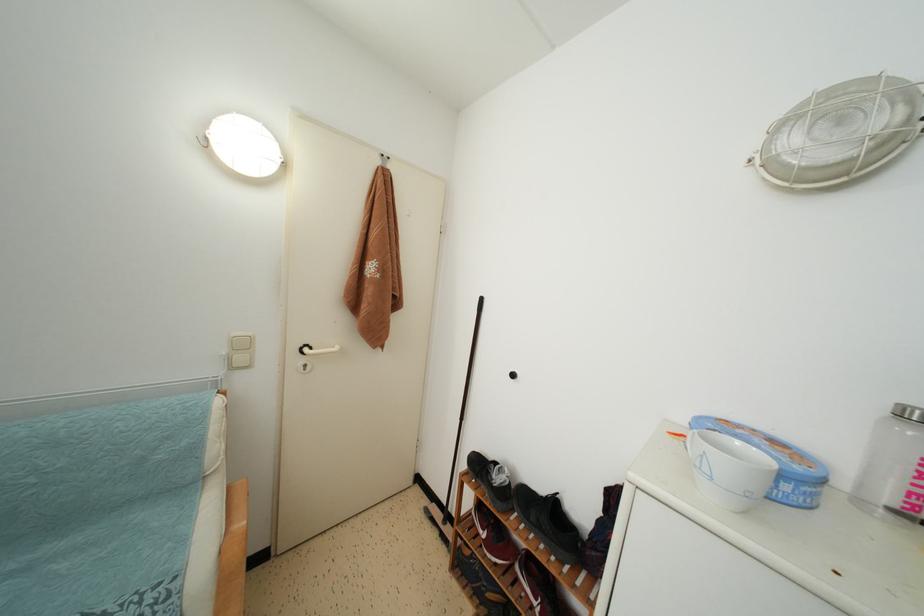
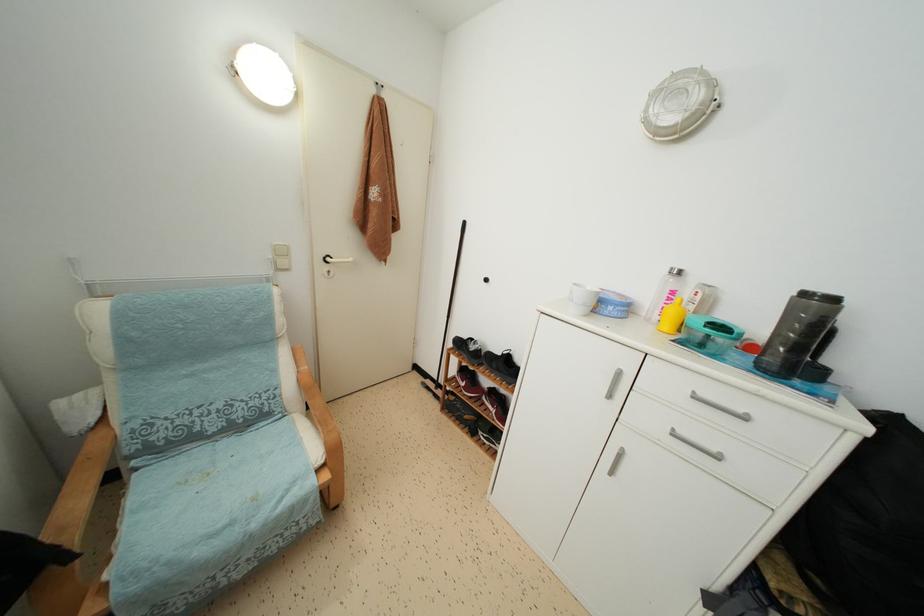
Find the pixel in the second image that matches [305,354] in the first image.

(329, 264)